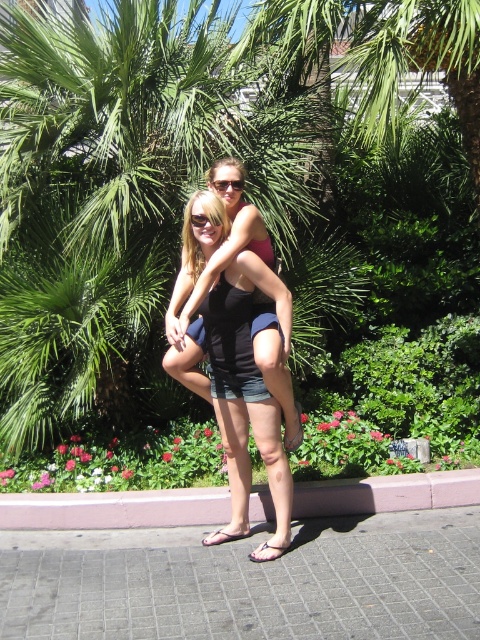
In the scene shown: Is brown leather sandal at lower center behind black rubber sandal at lower center?

Yes.

Who is more distant from viewer, (x=302, y=438) or (x=264, y=547)?

Positioned behind is point (x=302, y=438).

Identify the location of brown leather sandal at lower center. The height and width of the screenshot is (640, 480). (296, 433).

Does point (216, 540) come farther from viewer compared to point (277, 557)?

Yes, it is.

Does point (214, 536) come behind point (257, 557)?

Yes, point (214, 536) is farther from viewer.

Find the location of a particular element. This screenshot has height=640, width=480. pink fabric sandal at lower center is located at coordinates (223, 536).

Between gray tile pavement at lower center and black rubber sandal at lower center, which one has more height?

gray tile pavement at lower center

Between gray tile pavement at lower center and black rubber sandal at lower center, which one is positioned higher?

black rubber sandal at lower center is higher up.

Between point (369, 561) and point (252, 556), which one is positioned behind?

The point (252, 556) is more distant.

This screenshot has width=480, height=640. I want to click on gray tile pavement at lower center, so pyautogui.click(x=248, y=580).